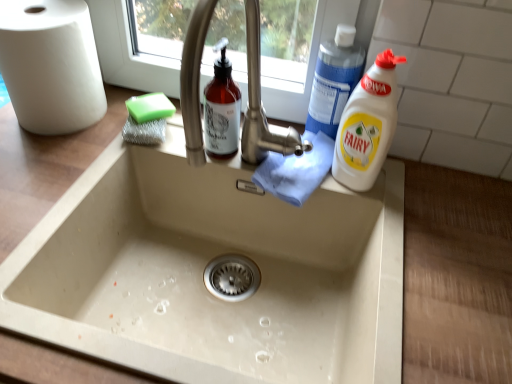
Image resolution: width=512 pixels, height=384 pixels. I want to click on vacant space in front of white matte paper towel at left, so click(48, 162).